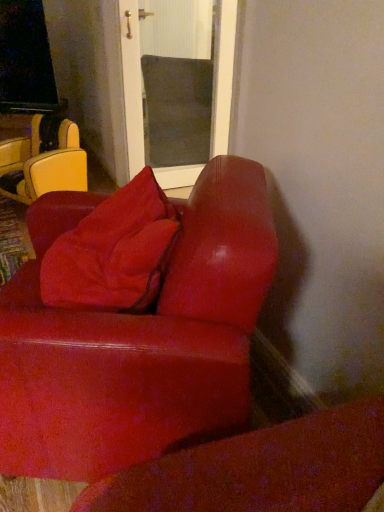
Question: Is leather-like yellow chair at left surrounding suede-like red couch at lower right?

Choices:
 (A) yes
 (B) no

Answer: (B)

Question: Are leather-like yellow chair at left and suede-like red couch at lower right far apart?

Choices:
 (A) no
 (B) yes

Answer: (B)

Question: From the image's perspective, would you say leather-like yellow chair at left is shown under suede-like red couch at lower right?

Choices:
 (A) no
 (B) yes

Answer: (A)

Question: From a real-world perspective, is leather-like yellow chair at left located higher than suede-like red couch at lower right?

Choices:
 (A) no
 (B) yes

Answer: (A)

Question: Can you confirm if leather-like yellow chair at left is bigger than suede-like red couch at lower right?

Choices:
 (A) no
 (B) yes

Answer: (A)

Question: Is leather-like yellow chair at left taller than suede-like red couch at lower right?

Choices:
 (A) no
 (B) yes

Answer: (A)

Question: Could you tell me if suede-like red couch at lower right is turned towards leather-like yellow chair at left?

Choices:
 (A) yes
 (B) no

Answer: (B)

Question: Considering the relative sizes of suede-like red couch at lower right and leather-like yellow chair at left in the image provided, is suede-like red couch at lower right smaller than leather-like yellow chair at left?

Choices:
 (A) no
 (B) yes

Answer: (A)

Question: Does suede-like red couch at lower right appear on the right side of leather-like yellow chair at left?

Choices:
 (A) no
 (B) yes

Answer: (B)

Question: Considering the relative sizes of suede-like red couch at lower right and leather-like yellow chair at left in the image provided, is suede-like red couch at lower right shorter than leather-like yellow chair at left?

Choices:
 (A) no
 (B) yes

Answer: (A)

Question: Considering the relative positions of suede-like red couch at lower right and leather-like yellow chair at left in the image provided, is suede-like red couch at lower right to the left of leather-like yellow chair at left from the viewer's perspective?

Choices:
 (A) yes
 (B) no

Answer: (B)

Question: Does suede-like red couch at lower right have a larger size compared to leather-like yellow chair at left?

Choices:
 (A) yes
 (B) no

Answer: (A)

Question: From a real-world perspective, is suede-like red pillow at center physically below leather-like yellow chair at left?

Choices:
 (A) no
 (B) yes

Answer: (A)